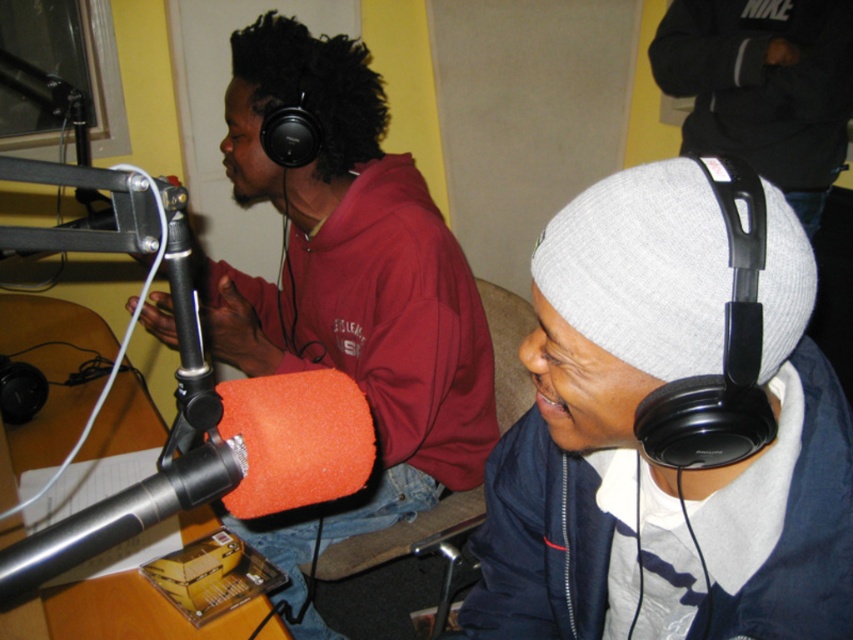
Question: Is the position of gray knit beanie at upper right less distant than that of orange foam microphone at center?

Choices:
 (A) no
 (B) yes

Answer: (A)

Question: Among these points, which one is nearest to the camera?

Choices:
 (A) (560, 348)
 (B) (440, 218)

Answer: (A)

Question: Which is nearer to the matte black headphones at left?

Choices:
 (A) gray knit beanie at upper right
 (B) orange foam microphone at center

Answer: (A)

Question: Is gray knit beanie at upper right thinner than orange foam microphone at center?

Choices:
 (A) yes
 (B) no

Answer: (A)

Question: Which point is closer to the camera?

Choices:
 (A) orange foam microphone at center
 (B) matte black headphones at left

Answer: (A)

Question: In this image, where is gray knit beanie at upper right located relative to matte black headphones at left?

Choices:
 (A) left
 (B) right

Answer: (B)